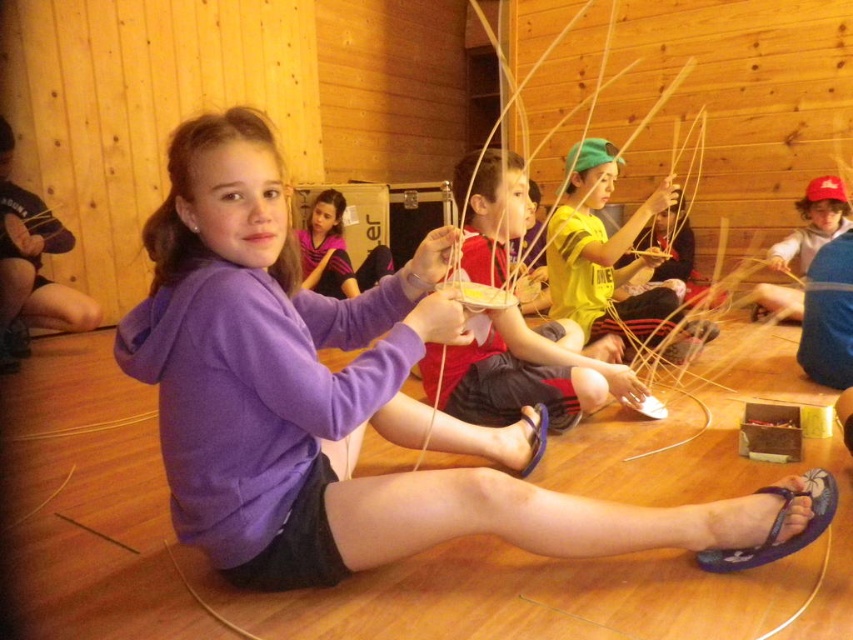
You are a photographer taking a picture of the children in the wooden cabin. You notice the yellow matte shirt at upper center and the matte blue hoodie at center. Which clothing item is positioned lower in the image?

The yellow matte shirt at upper center is located below the matte blue hoodie at center, so it is positioned lower in the image.

You are standing at the entrance of the wooden cabin and want to move towards the point labeled as point (184, 518). However, there is an obstacle at point (787, 321). Will you encounter the obstacle before reaching your destination?

Point (184, 518) is in front of point (787, 321). Therefore, you will reach the destination before encountering the obstacle at point (787, 321).